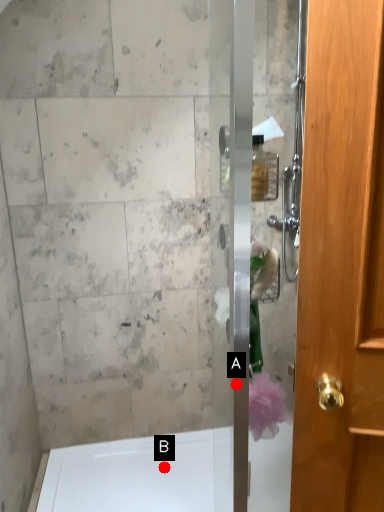
Question: Two points are circled on the image, labeled by A and B beside each circle. Which point is further to the camera?

Choices:
 (A) A is further
 (B) B is further

Answer: (B)